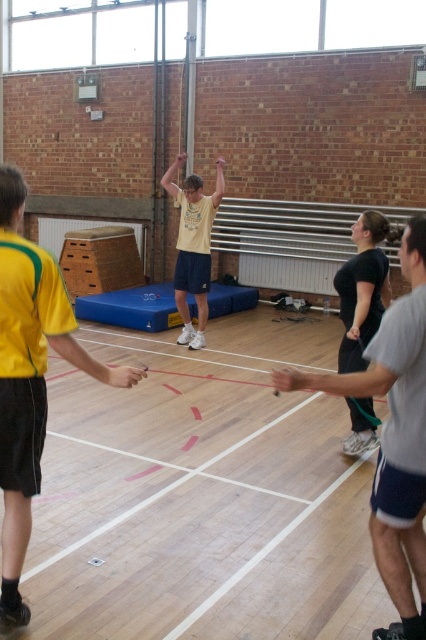
You are standing at the entrance of the gymnasium and want to locate the yellow jersey at left. Based on the coordinates provided, where would you look to find it?

The yellow jersey at left is located at the 2D coordinates point (29, 380). Since the coordinate system typically places the origin at the bottom left corner, this position corresponds to approximately 59.4 percent from the left edge and 7 percent from the bottom edge of the image. Therefore, you should look towards the lower left area of the gymnasium to find the yellow jersey at left.

You are standing in the gymnasium and see the gray fabric shorts at center. Where exactly are they located in terms of coordinates?

The gray fabric shorts at center are located at point coordinates of (394,436).

You are standing in the gymnasium and see the yellow jersey at left and the yellow matte shirt at center. Which one is positioned more to the left side of the gymnasium?

The yellow jersey at left is positioned more to the left side of the gymnasium than the yellow matte shirt at center.